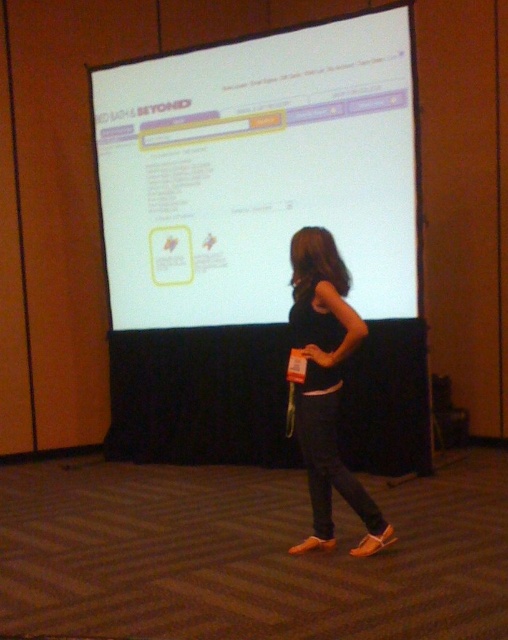
Question: Is white glossy projection screen at upper center positioned in front of black fabric dress at center?

Choices:
 (A) yes
 (B) no

Answer: (B)

Question: Which of the following is the farthest from the observer?

Choices:
 (A) black fabric dress at center
 (B) white glossy projection screen at upper center

Answer: (B)

Question: Can you confirm if white glossy projection screen at upper center is positioned above black fabric dress at center?

Choices:
 (A) yes
 (B) no

Answer: (A)

Question: Does white glossy projection screen at upper center appear on the right side of black fabric dress at center?

Choices:
 (A) yes
 (B) no

Answer: (B)

Question: Which point is closer to the camera?

Choices:
 (A) black fabric dress at center
 (B) white glossy projection screen at upper center

Answer: (A)